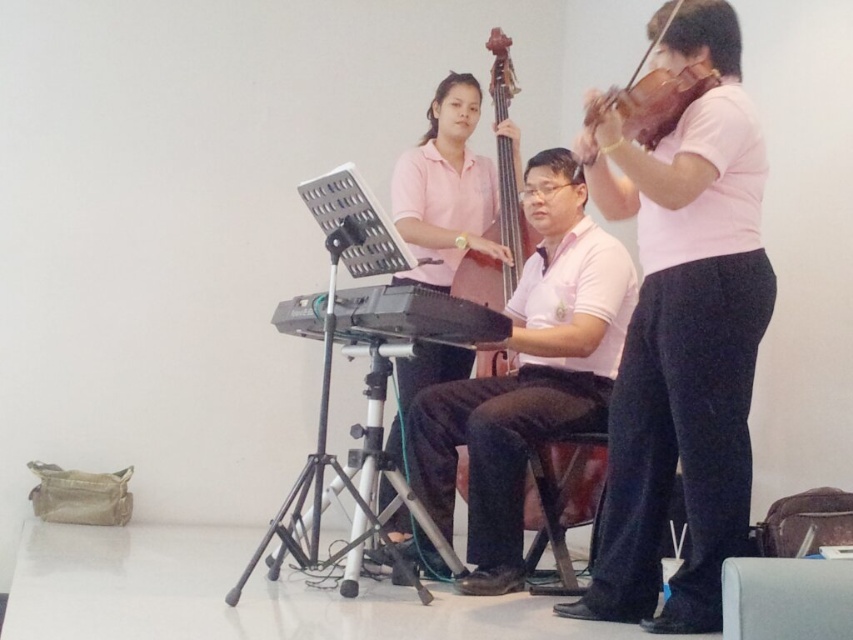
You are a photographer in the room and want to take a photo of the pink cotton shirt at center and the wooden violin at upper right. To ensure both are in frame, should you adjust your camera to focus on the left or the right side more?

The pink cotton shirt at center is to the left of the wooden violin at upper right, so you should focus on the left side to include both in the frame.

You are a photographer setting up for a group photo of the ensemble members. You need to ensure that both the pink matte shirt at center and the pink cotton shirt at center are visible in the frame. Which shirt should you position closer to the camera to ensure both are fully visible?

The pink cotton shirt at center should be positioned closer to the camera because the pink matte shirt at center is already on the right side of it, so moving the cotton shirt forward would keep both in frame without one blocking the other.

You are standing in front of the ensemble and want to determine which point is closer to you. Which point is closer between point (750,246) and point (442,413)?

Point (750,246) is closer to the camera than point (442,413).